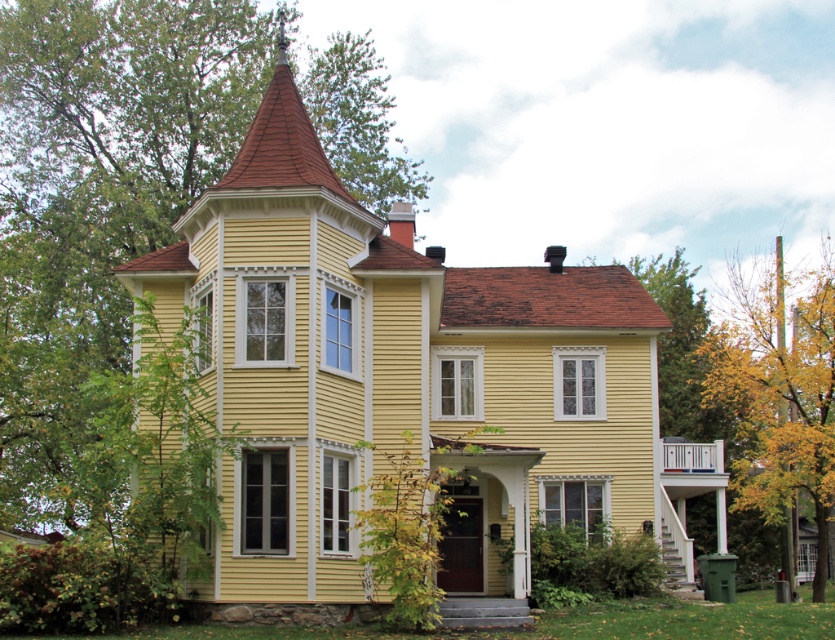
Between green leafy tree at upper left and yellow leafy tree at lower right, which one is positioned higher?

green leafy tree at upper left is higher up.

Who is more forward, [68,467] or [803,326]?

Point [68,467] is more forward.

Where is `green leafy tree at upper left`? This screenshot has width=835, height=640. green leafy tree at upper left is located at coordinates (99, 211).